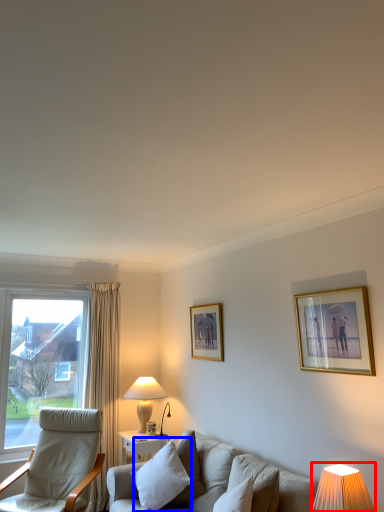
Question: Which object appears farthest to the camera in this image, table lamp (highlighted by a red box) or pillow (highlighted by a blue box)?

Choices:
 (A) table lamp
 (B) pillow

Answer: (B)